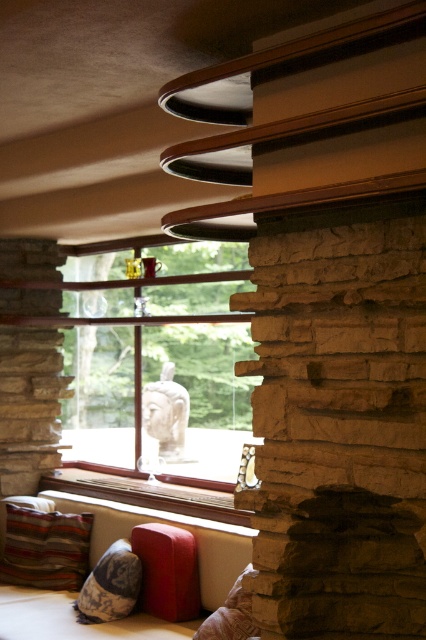
In the scene shown: You are standing in the room and see two points marked in the image. Which point is closer to you, point (x=135, y=522) or point (x=230, y=612)?

Point (x=135, y=522) is closer to you because it is further to the camera than point (x=230, y=612).

You are standing in the modern interior space described. There is a striped fabric pillow at lower left. Can you determine its exact location using the coordinate system provided?

The striped fabric pillow at lower left is located at point (46, 548).

You are arranging a small tray of snacks on a surface in this room. You have two options for placement based on the objects in the scene. The wooden at center and the velvety brown pillow at lower center. Which surface would you choose if you want the tray to be stable and not wobble?

The wooden at center is wider than the velvety brown pillow at lower center, making it a more stable surface for the tray to prevent wobbling.